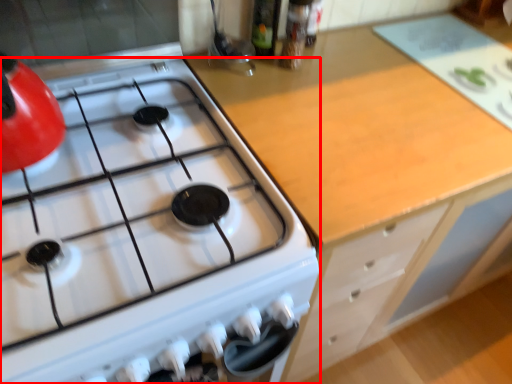
Question: From the image's perspective, where is gas stove (annotated by the red box) located relative to cabinetry?

Choices:
 (A) below
 (B) above

Answer: (B)